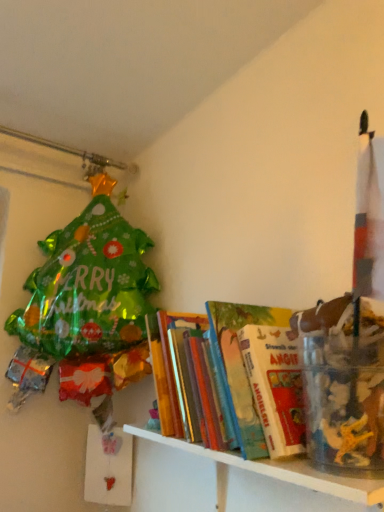
What is the approximate height of white wooden shelf at lower right, the first shelf from the bottom?

It is 19.33 centimeters.

What do you see at coordinates (281, 470) in the screenshot?
I see `white wooden shelf at lower right, the first shelf from the bottom` at bounding box center [281, 470].

Find the location of a particular element. The image size is (384, 512). white wooden shelf at lower right, the first shelf from the bottom is located at coordinates (281, 470).

Based on the photo, in order to face hardcover books at center, the 2th shelf when ordered from bottom to top, should I rotate leftwards or rightwards?

To face it directly, rotate right by 4.780 degrees.

Identify the location of hardcover books at center, the 2th shelf when ordered from bottom to top. (275, 472).

Describe the element at coordinates (275, 472) in the screenshot. I see `hardcover books at center, the 2th shelf when ordered from bottom to top` at that location.

You are a GUI agent. You are given a task and a screenshot of the screen. Output one action in this format:
    pyautogui.click(x=<x>, y=<y>)
    Task: Click on the white wooden shelf at lower right, marked as the second shelf in a top-to-bottom arrangement
    
    Given the screenshot: What is the action you would take?
    pyautogui.click(x=281, y=470)

Considering the relative positions of hardcover books at center, the 2th shelf when ordered from bottom to top, and white wooden shelf at lower right, marked as the second shelf in a top-to-bottom arrangement, in the image provided, is hardcover books at center, the 2th shelf when ordered from bottom to top, to the right of white wooden shelf at lower right, marked as the second shelf in a top-to-bottom arrangement, from the viewer's perspective?

No, hardcover books at center, the 2th shelf when ordered from bottom to top, is not to the right of white wooden shelf at lower right, marked as the second shelf in a top-to-bottom arrangement.

Which object is closer to the camera taking this photo, hardcover books at center, the 1th shelf positioned from the top, or white wooden shelf at lower right, the first shelf from the bottom?

white wooden shelf at lower right, the first shelf from the bottom.

Which is less distant, (352, 488) or (320, 488)?

The point (352, 488) is more forward.

From the image's perspective, is hardcover books at center, the 1th shelf positioned from the top, over white wooden shelf at lower right, marked as the second shelf in a top-to-bottom arrangement?

Yes, from the image's perspective, hardcover books at center, the 1th shelf positioned from the top, is on top of white wooden shelf at lower right, marked as the second shelf in a top-to-bottom arrangement.

From a real-world perspective, is hardcover books at center, the 2th shelf when ordered from bottom to top, above or below white wooden shelf at lower right, the first shelf from the bottom?

In terms of real-world spatial position, hardcover books at center, the 2th shelf when ordered from bottom to top, is above white wooden shelf at lower right, the first shelf from the bottom.

Considering the relative sizes of hardcover books at center, the 2th shelf when ordered from bottom to top, and white wooden shelf at lower right, marked as the second shelf in a top-to-bottom arrangement, in the image provided, is hardcover books at center, the 2th shelf when ordered from bottom to top, wider than white wooden shelf at lower right, marked as the second shelf in a top-to-bottom arrangement,?

Yes, hardcover books at center, the 2th shelf when ordered from bottom to top, is wider than white wooden shelf at lower right, marked as the second shelf in a top-to-bottom arrangement.

Considering the sizes of objects hardcover books at center, the 1th shelf positioned from the top, and white wooden shelf at lower right, marked as the second shelf in a top-to-bottom arrangement, in the image provided, who is taller, hardcover books at center, the 1th shelf positioned from the top, or white wooden shelf at lower right, marked as the second shelf in a top-to-bottom arrangement,?

hardcover books at center, the 1th shelf positioned from the top, is taller.

Considering the sizes of objects hardcover books at center, the 2th shelf when ordered from bottom to top, and white wooden shelf at lower right, the first shelf from the bottom, in the image provided, who is bigger, hardcover books at center, the 2th shelf when ordered from bottom to top, or white wooden shelf at lower right, the first shelf from the bottom,?

white wooden shelf at lower right, the first shelf from the bottom, is bigger.

Is hardcover books at center, the 1th shelf positioned from the top, spatially inside white wooden shelf at lower right, the first shelf from the bottom, or outside of it?

hardcover books at center, the 1th shelf positioned from the top, exists outside the volume of white wooden shelf at lower right, the first shelf from the bottom.

Are hardcover books at center, the 1th shelf positioned from the top, and white wooden shelf at lower right, marked as the second shelf in a top-to-bottom arrangement, far apart?

No, hardcover books at center, the 1th shelf positioned from the top, is in close proximity to white wooden shelf at lower right, marked as the second shelf in a top-to-bottom arrangement.

From the picture: Is hardcover books at center, the 1th shelf positioned from the top, turned away from white wooden shelf at lower right, the first shelf from the bottom?

No, hardcover books at center, the 1th shelf positioned from the top, is not facing away from white wooden shelf at lower right, the first shelf from the bottom.

How much distance is there between hardcover books at center, the 1th shelf positioned from the top, and white wooden shelf at lower right, the first shelf from the bottom?

hardcover books at center, the 1th shelf positioned from the top, and white wooden shelf at lower right, the first shelf from the bottom, are 0.37 inches apart.

The height and width of the screenshot is (512, 384). In order to click on shelf that is above the white wooden shelf at lower right, marked as the second shelf in a top-to-bottom arrangement (from the image's perspective) in this screenshot , I will do `click(275, 472)`.

Does white wooden shelf at lower right, the first shelf from the bottom, appear on the right side of hardcover books at center, the 1th shelf positioned from the top?

Correct, you'll find white wooden shelf at lower right, the first shelf from the bottom, to the right of hardcover books at center, the 1th shelf positioned from the top.

Is the position of white wooden shelf at lower right, marked as the second shelf in a top-to-bottom arrangement, more distant than that of hardcover books at center, the 1th shelf positioned from the top?

No, white wooden shelf at lower right, marked as the second shelf in a top-to-bottom arrangement, is closer to the camera.

Is point (315, 490) less distant than point (222, 464)?

Yes.

From the image's perspective, would you say white wooden shelf at lower right, marked as the second shelf in a top-to-bottom arrangement, is positioned over hardcover books at center, the 1th shelf positioned from the top?

No, from the image's perspective, white wooden shelf at lower right, marked as the second shelf in a top-to-bottom arrangement, is not over hardcover books at center, the 1th shelf positioned from the top.

From a real-world perspective, who is located lower, white wooden shelf at lower right, marked as the second shelf in a top-to-bottom arrangement, or hardcover books at center, the 2th shelf when ordered from bottom to top?

From a 3D spatial view, white wooden shelf at lower right, marked as the second shelf in a top-to-bottom arrangement, is below.

Consider the image. Can you confirm if white wooden shelf at lower right, the first shelf from the bottom, is thinner than hardcover books at center, the 1th shelf positioned from the top?

Yes.

Is white wooden shelf at lower right, the first shelf from the bottom, taller or shorter than hardcover books at center, the 2th shelf when ordered from bottom to top?

Considering their sizes, white wooden shelf at lower right, the first shelf from the bottom, has less height than hardcover books at center, the 2th shelf when ordered from bottom to top.

Who is bigger, white wooden shelf at lower right, the first shelf from the bottom, or hardcover books at center, the 1th shelf positioned from the top?

white wooden shelf at lower right, the first shelf from the bottom, is bigger.

Would you say hardcover books at center, the 1th shelf positioned from the top, is part of white wooden shelf at lower right, the first shelf from the bottom,'s contents?

Actually, hardcover books at center, the 1th shelf positioned from the top, is outside white wooden shelf at lower right, the first shelf from the bottom.

Would you consider white wooden shelf at lower right, the first shelf from the bottom, to be distant from hardcover books at center, the 2th shelf when ordered from bottom to top?

No.

Is white wooden shelf at lower right, the first shelf from the bottom, oriented towards hardcover books at center, the 1th shelf positioned from the top?

No, white wooden shelf at lower right, the first shelf from the bottom, does not turn towards hardcover books at center, the 1th shelf positioned from the top.

What's the angular difference between white wooden shelf at lower right, marked as the second shelf in a top-to-bottom arrangement, and hardcover books at center, the 1th shelf positioned from the top,'s facing directions?

They differ by 0.000503 degrees in their facing directions.

The width and height of the screenshot is (384, 512). What are the coordinates of `shelf below the hardcover books at center, the 1th shelf positioned from the top (from a real-world perspective)` in the screenshot? It's located at (281, 470).

Find the location of a particular element. shelf lying in front of the hardcover books at center, the 1th shelf positioned from the top is located at coordinates (281, 470).

The width and height of the screenshot is (384, 512). I want to click on shelf on the left of white wooden shelf at lower right, the first shelf from the bottom, so [x=275, y=472].